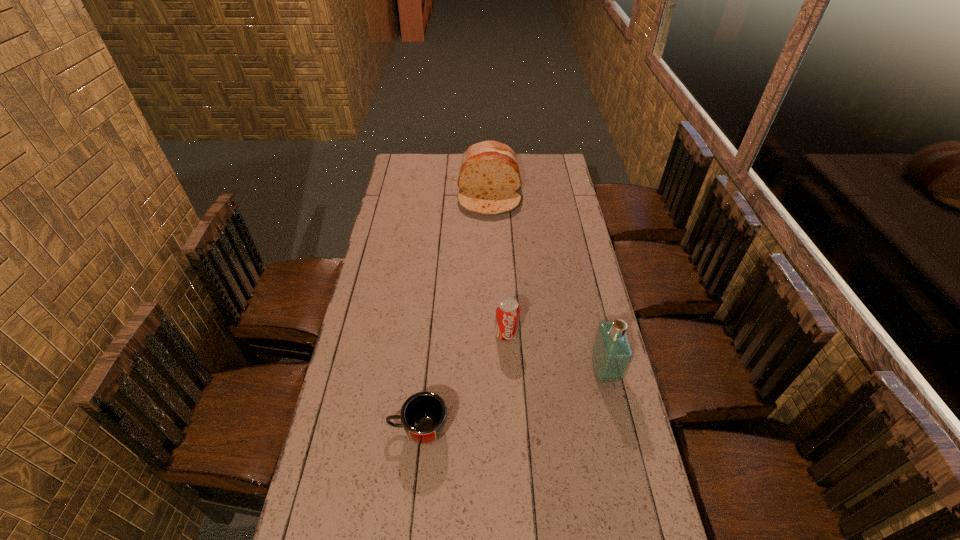
In order to click on vacant space situated 0.230m on the logo side of the soda can in this screenshot , I will do `click(513, 403)`.

This screenshot has height=540, width=960. Find the location of `blank area located on the logo side of the soda can`. blank area located on the logo side of the soda can is located at coordinates (517, 447).

At what (x,y) coordinates should I click in order to perform the action: click on vacant area situated 0.400m on the logo side of the soda can. Please return your answer as a coordinate pair (x, y). This screenshot has height=540, width=960. Looking at the image, I should click on (518, 457).

You are a GUI agent. You are given a task and a screenshot of the screen. Output one action in this format:
    pyautogui.click(x=<x>, y=<y>)
    Task: Click on the vacant space situated 0.190m at the sliced end of the farthest object
    This screenshot has height=540, width=960.
    Given the screenshot: What is the action you would take?
    pyautogui.click(x=490, y=246)

Where is `vacant space located 0.260m at the sliced end of the farthest object`? vacant space located 0.260m at the sliced end of the farthest object is located at coordinates (490, 257).

Image resolution: width=960 pixels, height=540 pixels. I want to click on free space located 0.280m at the sliced end of the farthest object, so click(490, 260).

Locate an element on the screen. object present at the far edge is located at coordinates (489, 176).

The width and height of the screenshot is (960, 540). Identify the location of object located in the right edge section of the desktop. 611,354.

I want to click on vacant region at the far edge of the desktop, so click(517, 158).

In the image, there is a desktop. Where is `blank space at the near edge`? blank space at the near edge is located at coordinates (440, 527).